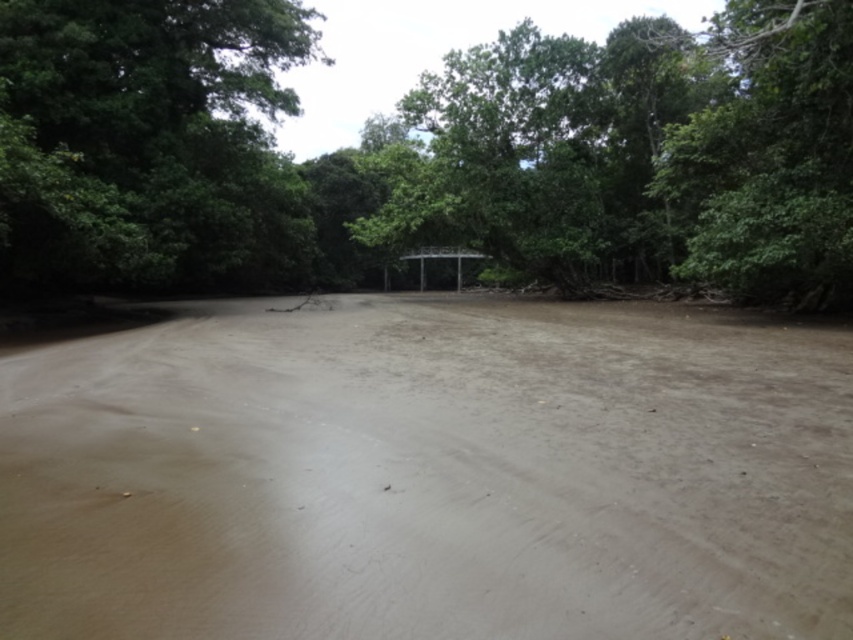
Question: Among these objects, which one is farthest from the camera?

Choices:
 (A) green leafy tree at center
 (B) brown muddy dirt track at center

Answer: (A)

Question: Which is farther from the brown muddy dirt track at center?

Choices:
 (A) green leafy tree at upper left
 (B) green leafy tree at center

Answer: (B)

Question: Estimate the real-world distances between objects in this image. Which object is farther from the brown muddy dirt track at center?

Choices:
 (A) green leafy tree at upper left
 (B) green leafy tree at center

Answer: (B)

Question: Is green leafy tree at center above green leafy tree at upper left?

Choices:
 (A) no
 (B) yes

Answer: (B)

Question: Can you confirm if brown muddy dirt track at center is positioned above green leafy tree at upper left?

Choices:
 (A) yes
 (B) no

Answer: (B)

Question: Can you confirm if brown muddy dirt track at center is bigger than green leafy tree at upper left?

Choices:
 (A) yes
 (B) no

Answer: (B)